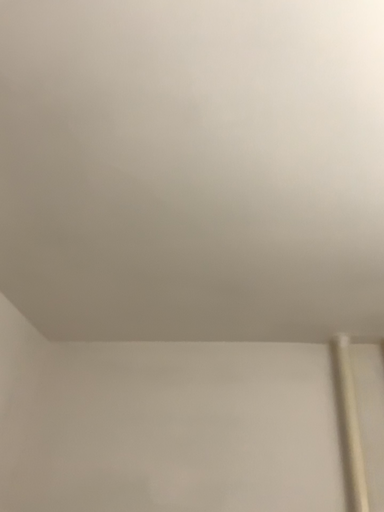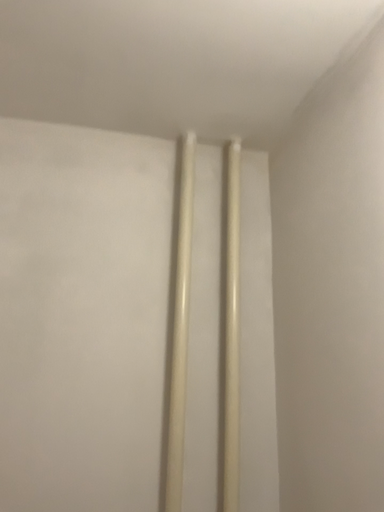
Question: How did the camera likely rotate when shooting the video?

Choices:
 (A) rotated left
 (B) rotated right

Answer: (B)